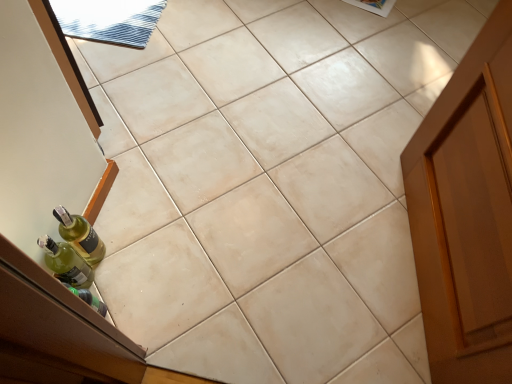
Question: Considering the relative sizes of green glass bottle at lower left, the first bottle viewed from the top, and green glass bottle at left, the first bottle in the bottom-to-top sequence, in the image provided, is green glass bottle at lower left, the first bottle viewed from the top, thinner than green glass bottle at left, the first bottle in the bottom-to-top sequence,?

Choices:
 (A) no
 (B) yes

Answer: (A)

Question: Would you say green glass bottle at lower left, the first bottle viewed from the top, is outside green glass bottle at left, marked as the 2th bottle in a top-to-bottom arrangement?

Choices:
 (A) yes
 (B) no

Answer: (A)

Question: Does green glass bottle at lower left, the first bottle viewed from the top, have a greater width compared to green glass bottle at left, marked as the 2th bottle in a top-to-bottom arrangement?

Choices:
 (A) no
 (B) yes

Answer: (B)

Question: Does green glass bottle at lower left, which is counted as the second bottle, starting from the bottom, turn towards green glass bottle at left, marked as the 2th bottle in a top-to-bottom arrangement?

Choices:
 (A) no
 (B) yes

Answer: (B)

Question: Does green glass bottle at lower left, which is counted as the second bottle, starting from the bottom, have a greater height compared to green glass bottle at left, marked as the 2th bottle in a top-to-bottom arrangement?

Choices:
 (A) yes
 (B) no

Answer: (B)

Question: Is green glass bottle at left, marked as the 2th bottle in a top-to-bottom arrangement, inside green glass bottle at lower left, the first bottle viewed from the top?

Choices:
 (A) yes
 (B) no

Answer: (B)

Question: From a real-world perspective, is green glass bottle at left, marked as the 2th bottle in a top-to-bottom arrangement, below green glass bottle at lower left, which is counted as the second bottle, starting from the bottom?

Choices:
 (A) no
 (B) yes

Answer: (A)

Question: From the image's perspective, would you say green glass bottle at left, the first bottle in the bottom-to-top sequence, is positioned over green glass bottle at lower left, the first bottle viewed from the top?

Choices:
 (A) no
 (B) yes

Answer: (A)

Question: Is green glass bottle at left, the first bottle in the bottom-to-top sequence, at the right side of green glass bottle at lower left, the first bottle viewed from the top?

Choices:
 (A) yes
 (B) no

Answer: (B)

Question: Does green glass bottle at left, the first bottle in the bottom-to-top sequence, have a lesser width compared to green glass bottle at lower left, the first bottle viewed from the top?

Choices:
 (A) yes
 (B) no

Answer: (A)

Question: Can you confirm if green glass bottle at left, the first bottle in the bottom-to-top sequence, is shorter than green glass bottle at lower left, the first bottle viewed from the top?

Choices:
 (A) yes
 (B) no

Answer: (B)

Question: Does green glass bottle at left, the first bottle in the bottom-to-top sequence, appear on the left side of green glass bottle at lower left, the first bottle viewed from the top?

Choices:
 (A) no
 (B) yes

Answer: (B)

Question: Relative to green glass bottle at left, the first bottle in the bottom-to-top sequence, is green glass bottle at lower left, which is counted as the second bottle, starting from the bottom, in front or behind?

Choices:
 (A) behind
 (B) front

Answer: (A)